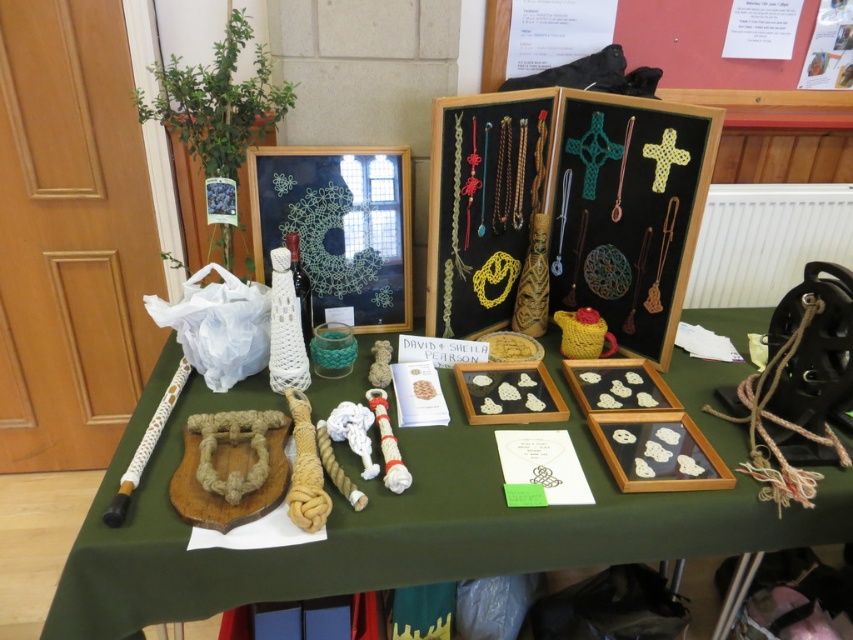
What is located at the point marked by the coordinates (399, 524) on the display table?

The point marked by the coordinates (399, 524) on the display table corresponds to the location of the natural fiber rope at left.